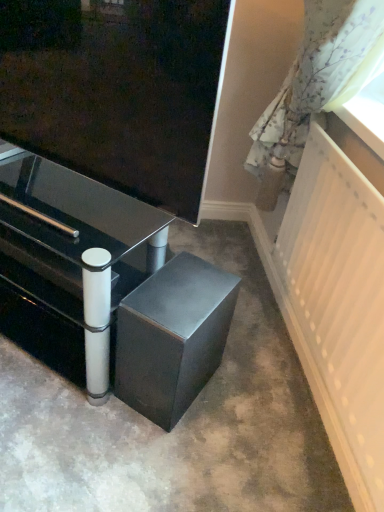
Question: Looking at their shapes, would you say white glossy drawer at lower left is wider or thinner than floral fabric curtain at right?

Choices:
 (A) thin
 (B) wide

Answer: (A)

Question: From a real-world perspective, is white glossy drawer at lower left positioned above or below floral fabric curtain at right?

Choices:
 (A) above
 (B) below

Answer: (B)

Question: Which object is the farthest from the white textured radiator at right?

Choices:
 (A) metallic black table at lower center
 (B) white glossy drawer at lower left
 (C) floral fabric curtain at right
 (D) satin black speaker at lower center

Answer: (B)

Question: Estimate the real-world distances between objects in this image. Which object is closer to the metallic black table at lower center?

Choices:
 (A) white glossy drawer at lower left
 (B) satin black speaker at lower center
 (C) white textured radiator at right
 (D) floral fabric curtain at right

Answer: (A)